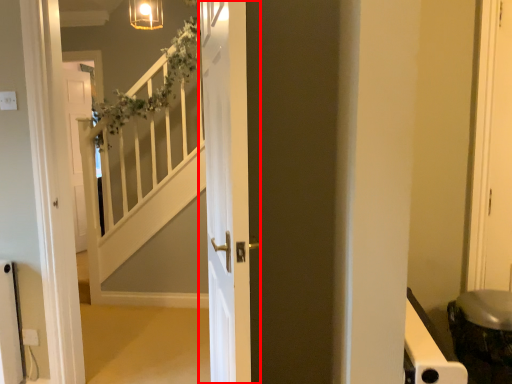
Question: From the image's perspective, where is door (annotated by the red box) located in relation to electric outlet in the image?

Choices:
 (A) below
 (B) above

Answer: (B)